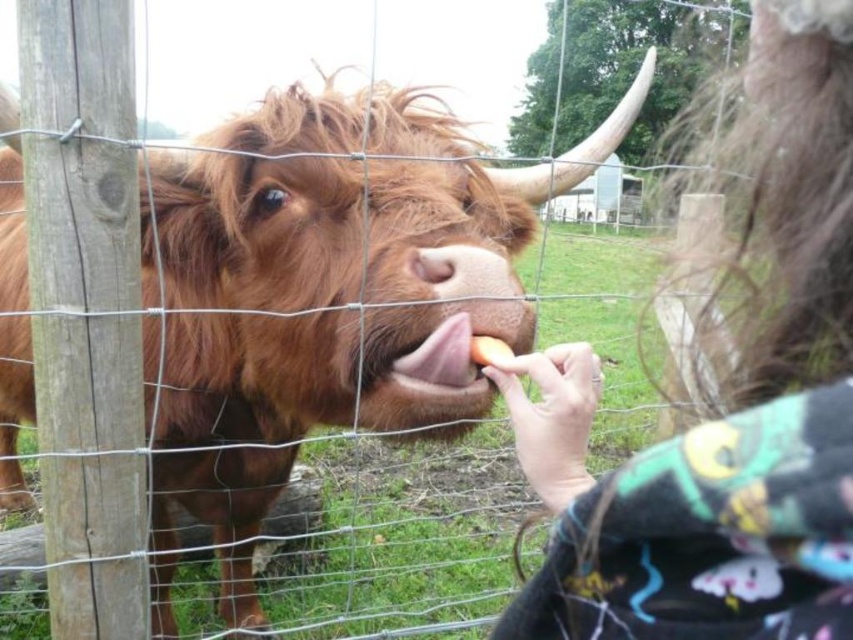
Does fluffy brown hair at upper right come in front of yellow matte apple at center?

Yes, it is in front of yellow matte apple at center.

Is point (838, 340) positioned behind point (492, 348)?

That is False.

Identify the location of fluffy brown hair at upper right. (724, 417).

Between brown fuzzy bison at center and yellow matte apple at center, which one appears on the left side from the viewer's perspective?

From the viewer's perspective, brown fuzzy bison at center appears more on the left side.

Is brown fuzzy bison at center positioned behind yellow matte apple at center?

Yes, brown fuzzy bison at center is behind yellow matte apple at center.

Which is behind, point (202, 444) or point (495, 337)?

Positioned behind is point (202, 444).

Locate an element on the screen. This screenshot has width=853, height=640. brown fuzzy bison at center is located at coordinates (320, 288).

Does brown fuzzy bison at center have a lesser width compared to fluffy brown hair at upper right?

No, brown fuzzy bison at center is not thinner than fluffy brown hair at upper right.

Based on the photo, does brown fuzzy bison at center have a lesser height compared to fluffy brown hair at upper right?

No.

Where is `brown fuzzy bison at center`? brown fuzzy bison at center is located at coordinates (320, 288).

I want to click on brown fuzzy bison at center, so click(x=320, y=288).